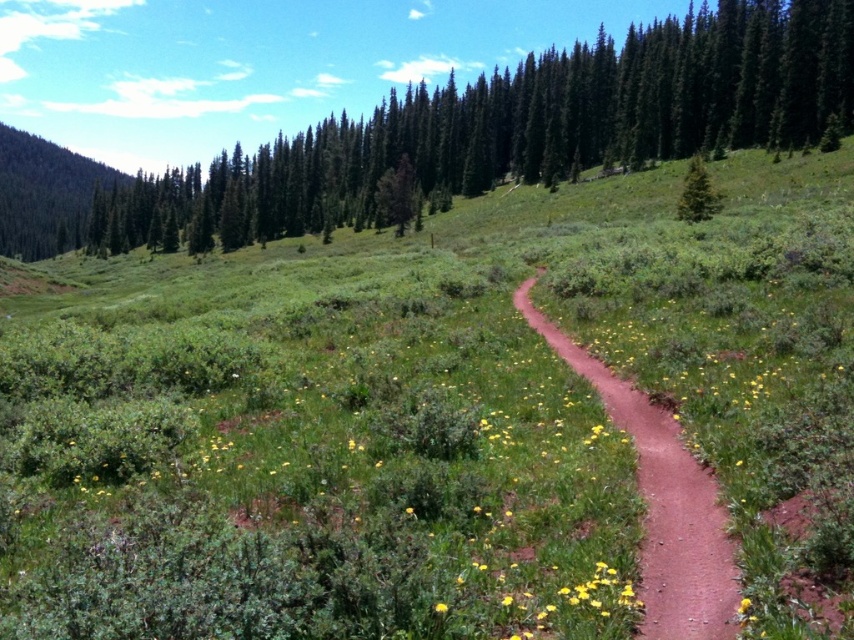
Question: Is green textured tree at upper center wider than green textured pine tree at upper right?

Choices:
 (A) no
 (B) yes

Answer: (B)

Question: Which point is closer to the camera?

Choices:
 (A) tap(697, 212)
 (B) tap(793, 35)
 (C) tap(591, 376)
 (D) tap(437, 604)

Answer: (D)

Question: Does green textured tree at upper center appear on the right side of yellow matte flower at center?

Choices:
 (A) yes
 (B) no

Answer: (B)

Question: Among these points, which one is nearest to the camera?

Choices:
 (A) (712, 614)
 (B) (445, 605)

Answer: (B)

Question: Is green textured tree at upper center wider than green textured pine tree at upper right?

Choices:
 (A) yes
 (B) no

Answer: (A)

Question: Which of the following is the farthest from the observer?

Choices:
 (A) (676, 634)
 (B) (154, 241)

Answer: (B)